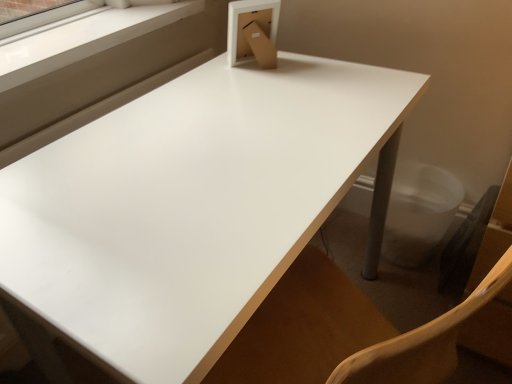
Question: From a real-world perspective, is white glossy table at center physically above white plastic window frame at upper left?

Choices:
 (A) yes
 (B) no

Answer: (B)

Question: Is white glossy table at center taller than white plastic window frame at upper left?

Choices:
 (A) no
 (B) yes

Answer: (B)

Question: Considering the relative sizes of white glossy table at center and white plastic window frame at upper left in the image provided, is white glossy table at center wider than white plastic window frame at upper left?

Choices:
 (A) no
 (B) yes

Answer: (B)

Question: Is white glossy table at center at the right side of white plastic window frame at upper left?

Choices:
 (A) no
 (B) yes

Answer: (B)

Question: Would you consider white glossy table at center to be distant from white plastic window frame at upper left?

Choices:
 (A) yes
 (B) no

Answer: (B)

Question: Is white glossy table at center further to the viewer compared to white plastic window frame at upper left?

Choices:
 (A) no
 (B) yes

Answer: (A)

Question: Can we say white plastic window frame at upper left lies outside white glossy table at center?

Choices:
 (A) no
 (B) yes

Answer: (B)

Question: From the image's perspective, would you say white plastic window frame at upper left is shown under white glossy table at center?

Choices:
 (A) yes
 (B) no

Answer: (B)

Question: Does white plastic window frame at upper left lie behind white glossy table at center?

Choices:
 (A) yes
 (B) no

Answer: (A)

Question: From the image's perspective, would you say white plastic window frame at upper left is positioned over white glossy table at center?

Choices:
 (A) no
 (B) yes

Answer: (B)

Question: Is white glossy table at center completely or partially inside white plastic window frame at upper left?

Choices:
 (A) no
 (B) yes

Answer: (A)

Question: From a real-world perspective, is white plastic window frame at upper left on top of white glossy table at center?

Choices:
 (A) yes
 (B) no

Answer: (A)

Question: In the image, is white glossy table at center on the left side or the right side of white plastic window frame at upper left?

Choices:
 (A) left
 (B) right

Answer: (B)